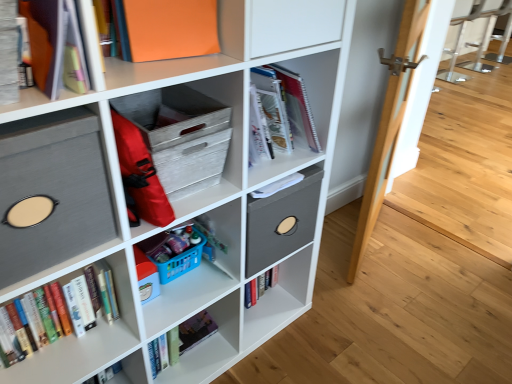
Question: From a real-world perspective, is hardcover books at left above or below wooden crate at center, acting as the third shelf starting from the bottom?

Choices:
 (A) above
 (B) below

Answer: (B)

Question: Which is correct: hardcover books at left is inside wooden crate at center, placed as the second shelf when sorted from top to bottom, or outside of it?

Choices:
 (A) outside
 (B) inside

Answer: (A)

Question: Which of these objects is positioned farthest from the wooden crate at center, acting as the third shelf starting from the bottom?

Choices:
 (A) gray fabric storage bin at left, which ranks as the third shelf in top-to-bottom order
 (B) matte gray fabric storage cube at upper left, the fourth shelf in the top-to-bottom sequence
 (C) matte orange folder at upper left, marked as the 4th shelf in a bottom-to-top arrangement
 (D) hardcover books at left
 (E) orange matte paper at upper center

Answer: (D)

Question: Based on their relative distances, which object is nearer to the hardcover books at left?

Choices:
 (A) gray fabric storage bin at left, which ranks as the third shelf in top-to-bottom order
 (B) wooden crate at center, placed as the second shelf when sorted from top to bottom
 (C) matte orange folder at upper left, the first shelf viewed from the top
 (D) orange matte paper at upper center
 (E) matte gray fabric storage cube at upper left, arranged as the first shelf when ordered from the bottom

Answer: (E)